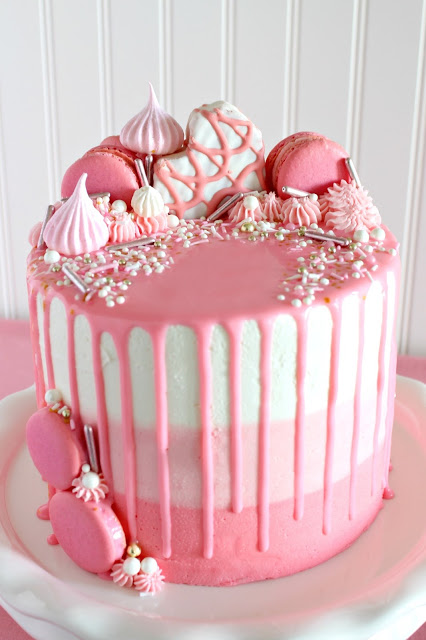
At what (x,y) coordinates should I click in order to perform the action: click on wall. Please return your answer as a coordinate pair (x, y). The width and height of the screenshot is (426, 640). Looking at the image, I should click on (267, 98).